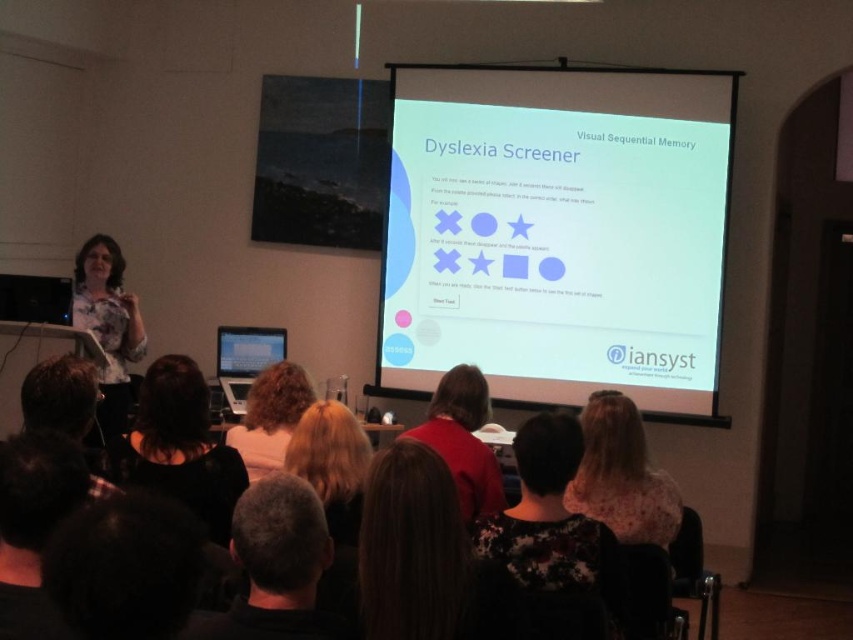
Question: Which of the following is the farthest from the observer?

Choices:
 (A) blonde hair at center
 (B) black hair at center
 (C) dark hair at upper center

Answer: (A)

Question: Considering the real-world distances, which object is farthest from the red sweater at center?

Choices:
 (A) white glossy projector screen at center
 (B) floral-patterned blouse at center
 (C) dark brown hair at lower center
 (D) matte black laptop at center

Answer: (A)

Question: Is white printed shirt at left positioned in front of brown hair at lower left?

Choices:
 (A) no
 (B) yes

Answer: (A)

Question: Which point is farther from the camera taking this photo?

Choices:
 (A) (254, 460)
 (B) (299, 637)

Answer: (A)

Question: Does brown hair at lower left appear under blonde hair at center?

Choices:
 (A) no
 (B) yes

Answer: (A)

Question: Is white glossy projector screen at center positioned behind brown hair at lower left?

Choices:
 (A) no
 (B) yes

Answer: (B)